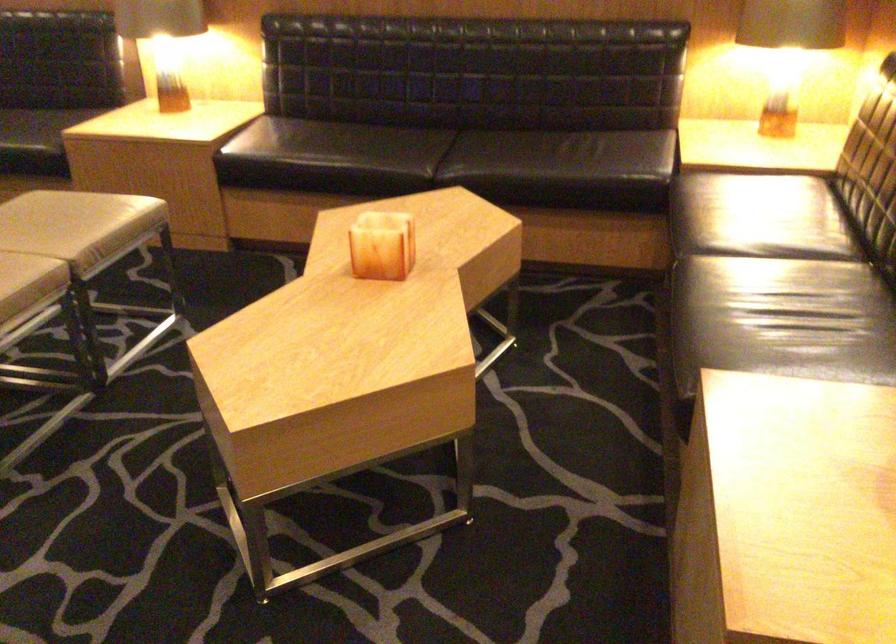
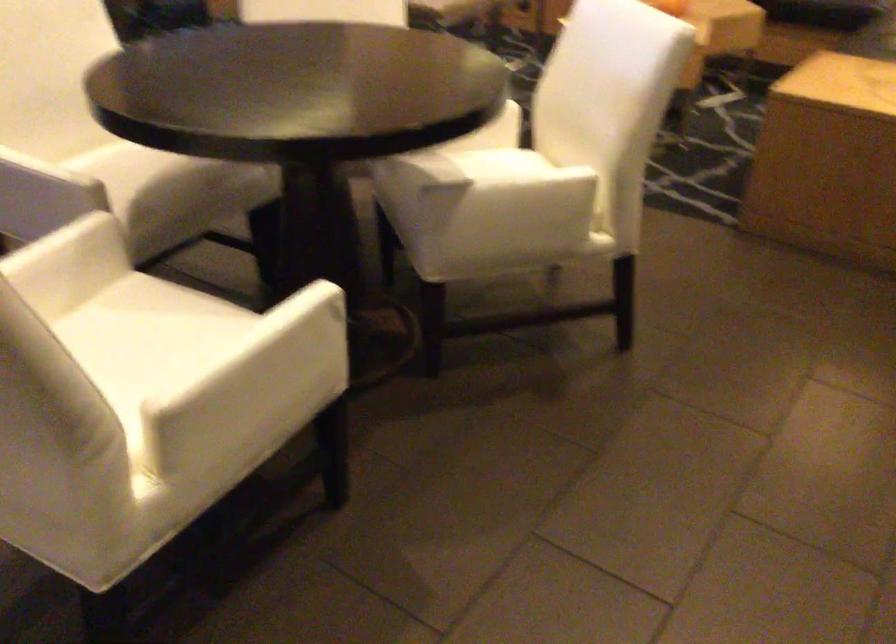
Question: What movement of the cameraman would produce the second image?

Choices:
 (A) Left
 (B) Right
 (C) Forward
 (D) Backward

Answer: (D)